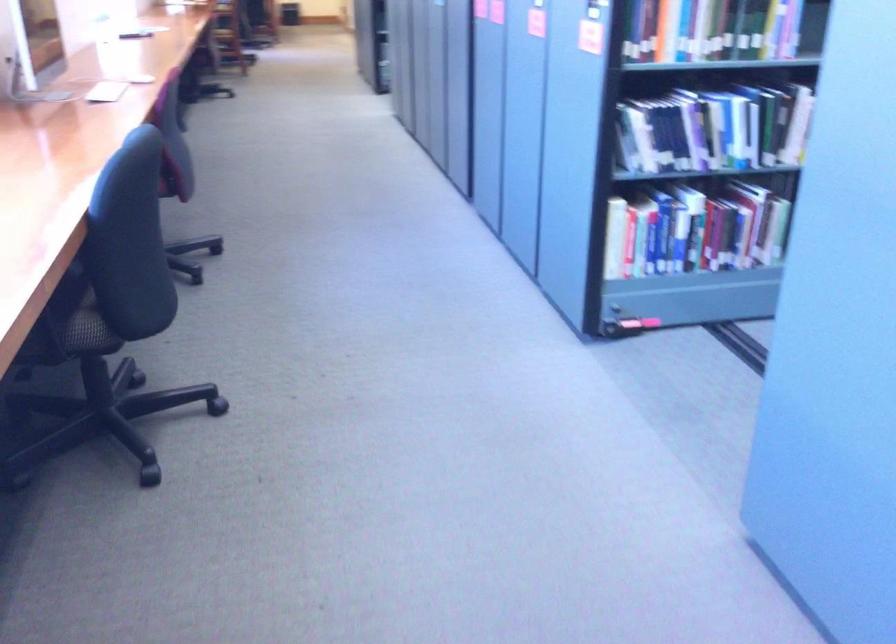
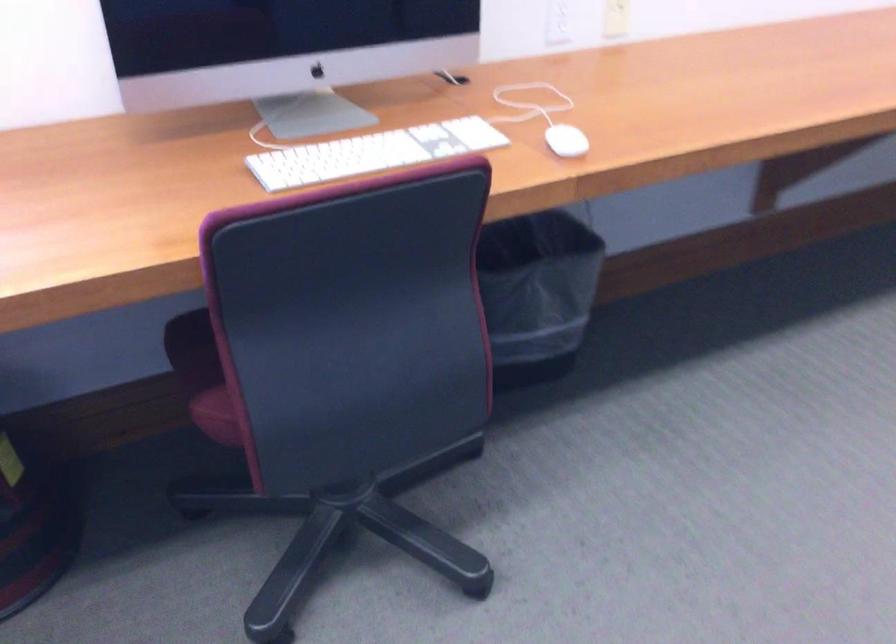
Locate, in the second image, the point that corresponds to point 121,88 in the first image.

(372, 153)